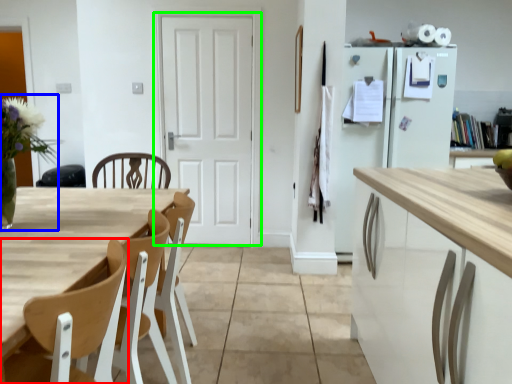
Question: Which object is positioned closest to chair (highlighted by a red box)? Select from floral arrangement (highlighted by a blue box) and door (highlighted by a green box).

Choices:
 (A) floral arrangement
 (B) door

Answer: (A)